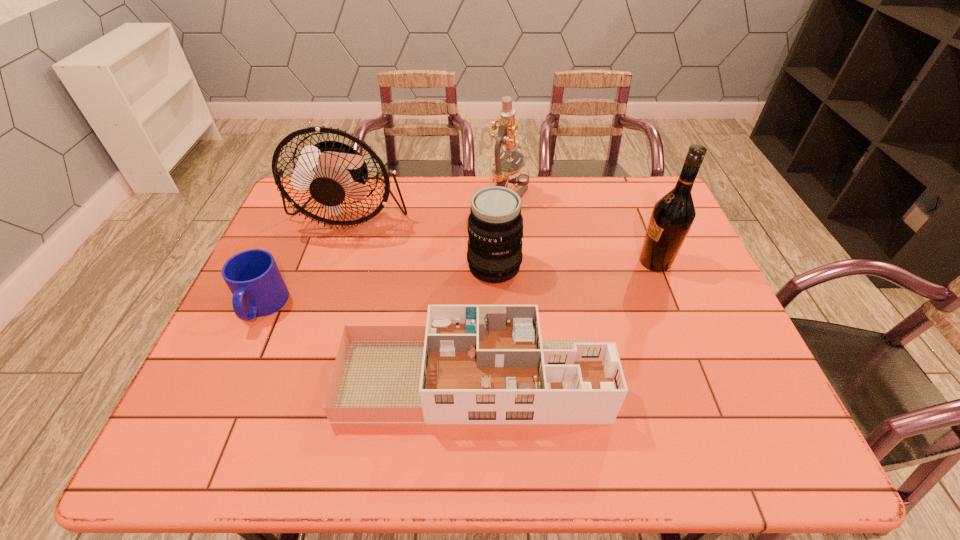
Image resolution: width=960 pixels, height=540 pixels. I want to click on the rightmost object, so click(672, 216).

Find the location of a particular element. The height and width of the screenshot is (540, 960). microscope is located at coordinates (504, 172).

Locate an element on the screen. This screenshot has width=960, height=540. fan is located at coordinates (330, 170).

Locate an element on the screen. the third shortest object is located at coordinates (495, 225).

Find the location of a particular element. dollhouse is located at coordinates coord(471,364).

I want to click on mug, so click(253, 277).

Find the location of a particular element. vacant space situated 0.110m on the label of the rightmost object is located at coordinates (598, 262).

Find the location of a particular element. The height and width of the screenshot is (540, 960). vacant space located 0.330m on the label of the rightmost object is located at coordinates (521, 262).

Where is `vacant space located on the label of the rightmost object`? This screenshot has height=540, width=960. vacant space located on the label of the rightmost object is located at coordinates (517, 262).

You are a GUI agent. You are given a task and a screenshot of the screen. Output one action in this format:
    pyautogui.click(x=<x>, y=<y>)
    Task: Click on the vacant space located on the left of the microscope
    
    Given the screenshot: What is the action you would take?
    pyautogui.click(x=433, y=195)